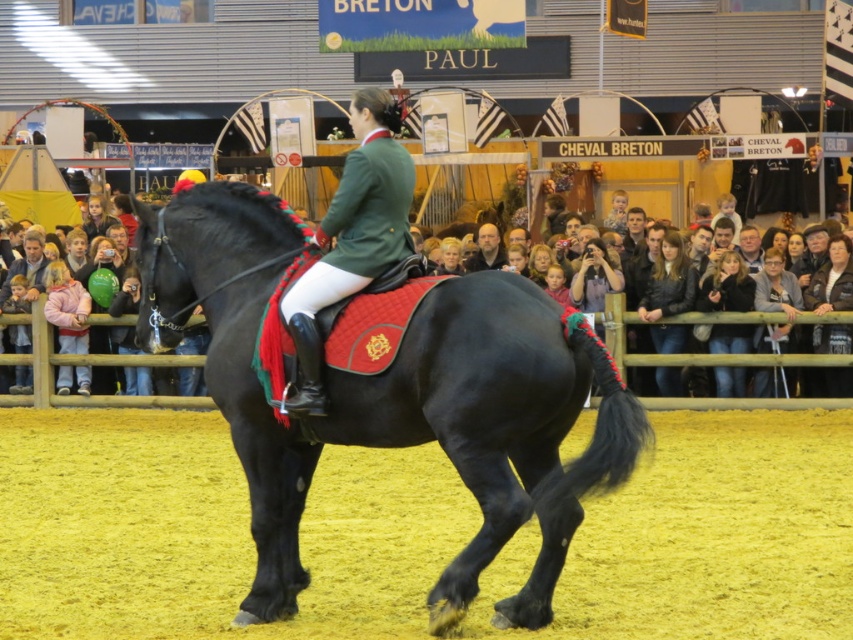
Which is more to the right, green matte jacket at center or gray fabric jacket at center?

Positioned to the right is gray fabric jacket at center.

This screenshot has height=640, width=853. What are the coordinates of `green matte jacket at center` in the screenshot? It's located at (351, 237).

In the scene shown: Is smooth wooden fence at lower center taller than dark blue denim jacket at center?

Indeed, smooth wooden fence at lower center has a greater height compared to dark blue denim jacket at center.

Identify the location of smooth wooden fence at lower center. (701, 355).

Looking at this image, can you confirm if dark blue denim jacket at center is taller than dark brown leather jacket at center?

Yes, dark blue denim jacket at center is taller than dark brown leather jacket at center.

Is dark blue denim jacket at center positioned before dark brown leather jacket at center?

Yes, dark blue denim jacket at center is in front of dark brown leather jacket at center.

Who is more forward, (679, 372) or (474, 264)?

Point (679, 372) is in front.

I want to click on dark blue denim jacket at center, so click(x=668, y=294).